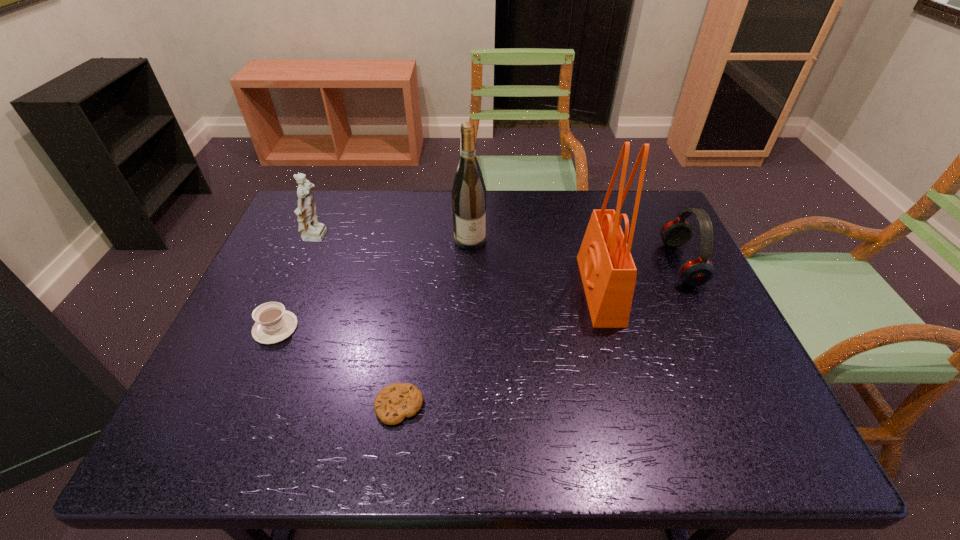
The width and height of the screenshot is (960, 540). What are the coordinates of `free region located 0.170m on the logo side of the tote bag` in the screenshot? It's located at (517, 290).

Locate an element on the screen. The width and height of the screenshot is (960, 540). vacant space positioned on the logo side of the tote bag is located at coordinates (444, 290).

At what (x,y) coordinates should I click in order to perform the action: click on free space located 0.170m on the right of the wine bottle. Please return your answer as a coordinate pair (x, y). Image resolution: width=960 pixels, height=540 pixels. Looking at the image, I should click on (544, 239).

The height and width of the screenshot is (540, 960). Find the location of `free space located 0.250m on the front-facing side of the third tallest object`. free space located 0.250m on the front-facing side of the third tallest object is located at coordinates (418, 238).

Find the location of a particular element. The height and width of the screenshot is (540, 960). vacant area situated on the ear cups of the earphone is located at coordinates tap(571, 264).

Locate an element on the screen. The height and width of the screenshot is (540, 960). blank space located 0.150m on the ear cups of the earphone is located at coordinates (612, 264).

Where is `vacant space situated 0.290m on the ear cups of the earphone`? The image size is (960, 540). vacant space situated 0.290m on the ear cups of the earphone is located at coordinates (561, 264).

At what (x,y) coordinates should I click in order to perform the action: click on free space located on the handle side of the teacup. Please return your answer as a coordinate pair (x, y). Looking at the image, I should click on (x=232, y=328).

Identify the location of free space located 0.370m on the left of the shortest object. The height and width of the screenshot is (540, 960). (195, 406).

This screenshot has height=540, width=960. Identify the location of wine bottle that is at the far edge. (469, 193).